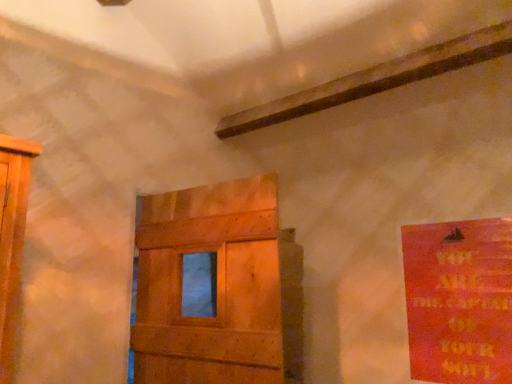
What is the approximate width of red matte poster at right?

red matte poster at right is 1.65 inches wide.

At what (x,y) coordinates should I click in order to perform the action: click on red matte poster at right. Please return your answer as a coordinate pair (x, y). This screenshot has width=512, height=384. Looking at the image, I should click on (459, 301).

Describe the element at coordinates (459, 301) in the screenshot. The height and width of the screenshot is (384, 512). I see `red matte poster at right` at that location.

This screenshot has height=384, width=512. Identify the location of wooden door at center. (216, 286).

The image size is (512, 384). What do you see at coordinates (216, 286) in the screenshot? I see `wooden door at center` at bounding box center [216, 286].

Identify the location of red matte poster at right. (459, 301).

Which object is positioned more to the right, wooden door at center or red matte poster at right?

red matte poster at right is more to the right.

Which is behind, wooden door at center or red matte poster at right?

red matte poster at right is further from the camera.

Does point (175, 341) come in front of point (454, 366)?

Yes, it is.

From the image's perspective, would you say wooden door at center is shown under red matte poster at right?

No, from the image's perspective, wooden door at center is not beneath red matte poster at right.

From a real-world perspective, is wooden door at center on top of red matte poster at right?

Indeed, from a real-world perspective, wooden door at center stands above red matte poster at right.

Looking at their sizes, would you say wooden door at center is wider or thinner than red matte poster at right?

Considering their sizes, wooden door at center looks broader than red matte poster at right.

Considering the relative sizes of wooden door at center and red matte poster at right in the image provided, is wooden door at center taller than red matte poster at right?

Yes, wooden door at center is taller than red matte poster at right.

Which of these two, wooden door at center or red matte poster at right, is bigger?

wooden door at center.

Is wooden door at center spatially inside red matte poster at right, or outside of it?

wooden door at center is located beyond the bounds of red matte poster at right.

Consider the image. Is wooden door at center touching red matte poster at right?

No.

Does wooden door at center turn towards red matte poster at right?

No, wooden door at center does not turn towards red matte poster at right.

I want to click on door on the left of red matte poster at right, so click(216, 286).

Which object is positioned more to the right, red matte poster at right or wooden door at center?

red matte poster at right is more to the right.

Based on the photo, is red matte poster at right in front of or behind wooden door at center in the image?

red matte poster at right is positioned farther from the viewer than wooden door at center.

Considering the positions of points (463, 302) and (156, 282), is point (463, 302) farther from camera compared to point (156, 282)?

That is True.

From the image's perspective, is red matte poster at right above or below wooden door at center?

Based on their image positions, red matte poster at right is located beneath wooden door at center.

From a real-world perspective, which is physically below, red matte poster at right or wooden door at center?

Result: red matte poster at right, from a real-world perspective.

Considering the relative sizes of red matte poster at right and wooden door at center in the image provided, is red matte poster at right wider than wooden door at center?

Incorrect, the width of red matte poster at right does not surpass that of wooden door at center.

Is red matte poster at right taller or shorter than wooden door at center?

Clearly, red matte poster at right is shorter compared to wooden door at center.

Does red matte poster at right have a smaller size compared to wooden door at center?

Yes.

Is red matte poster at right surrounding wooden door at center?

No, red matte poster at right does not contain wooden door at center.

Is red matte poster at right placed right next to wooden door at center?

red matte poster at right and wooden door at center are not in contact.

Could you tell me if red matte poster at right is turned towards wooden door at center?

No.

How many degrees apart are the facing directions of red matte poster at right and wooden door at center?

The angle between the facing direction of red matte poster at right and the facing direction of wooden door at center is 8.49 degrees.

I want to click on door that is above the red matte poster at right (from a real-world perspective), so click(x=216, y=286).

The height and width of the screenshot is (384, 512). I want to click on door above the red matte poster at right (from the image's perspective), so click(x=216, y=286).

At what (x,y) coordinates should I click in order to perform the action: click on door in front of the red matte poster at right. Please return your answer as a coordinate pair (x, y). The width and height of the screenshot is (512, 384). Looking at the image, I should click on (216, 286).